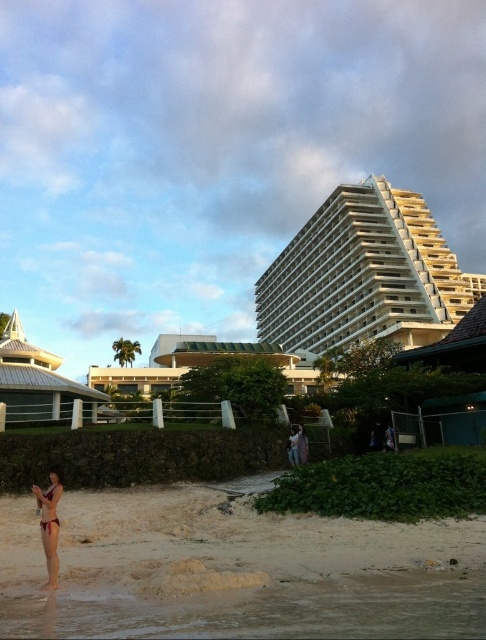
Question: Can you confirm if beige sand at lower left is positioned below matte pink bikini at lower left?

Choices:
 (A) no
 (B) yes

Answer: (B)

Question: Can you confirm if beige sand at lower left is thinner than white textured dome at left?

Choices:
 (A) yes
 (B) no

Answer: (B)

Question: Which of the following is the closest to the observer?

Choices:
 (A) (219, 570)
 (B) (243, 624)
 (C) (326, 269)

Answer: (B)

Question: Which point is farther to the camera?

Choices:
 (A) (40, 506)
 (B) (427, 536)
 (C) (271, 608)
 (D) (364, 237)

Answer: (D)

Question: Can you confirm if beige sand at lower left is positioned to the left of white textured dome at left?

Choices:
 (A) yes
 (B) no

Answer: (B)

Question: Which point is closer to the camera?

Choices:
 (A) dark red bikini at lower left
 (B) matte pink bikini at lower left
 (C) clear water at lower left

Answer: (C)